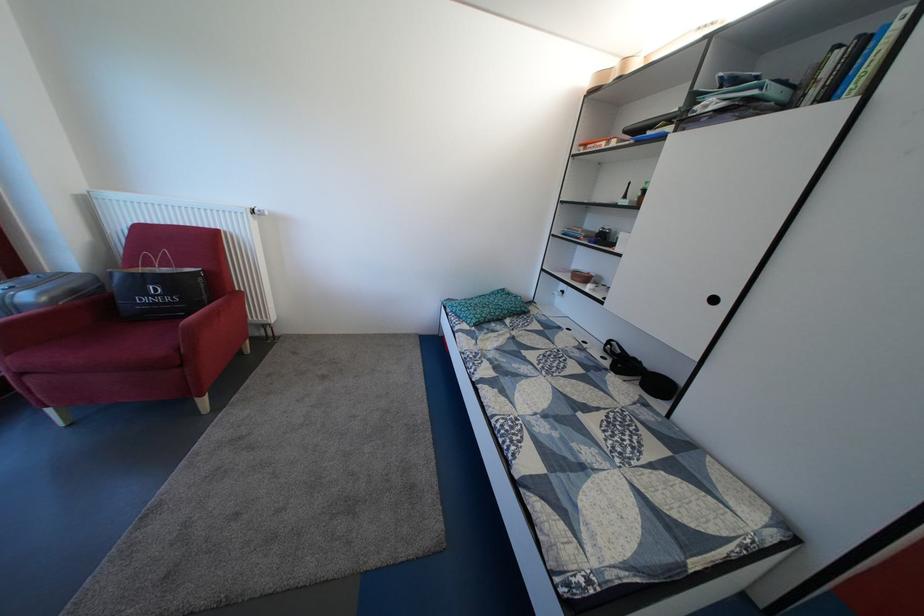
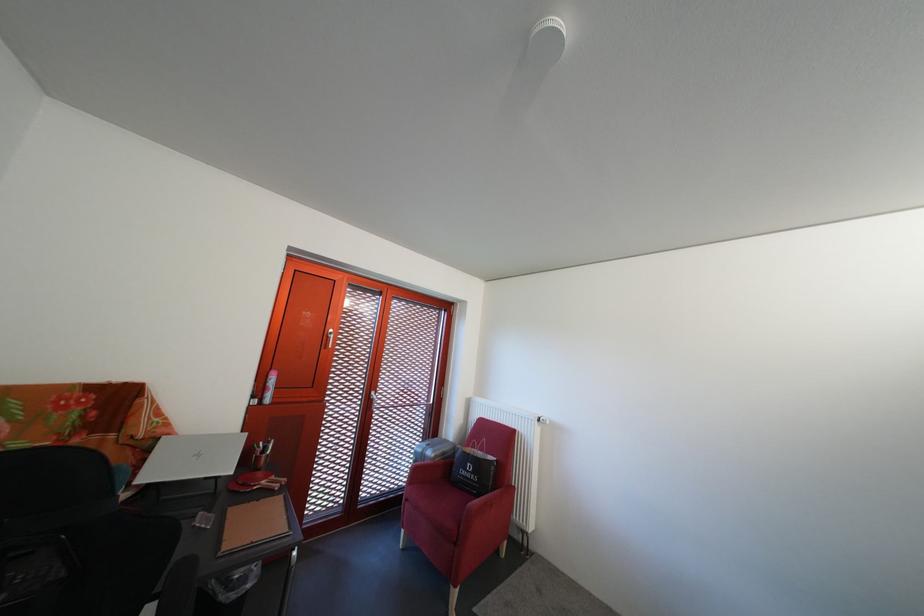
In the second image, find the point that corresponds to the point at 264,230 in the first image.

(549, 436)